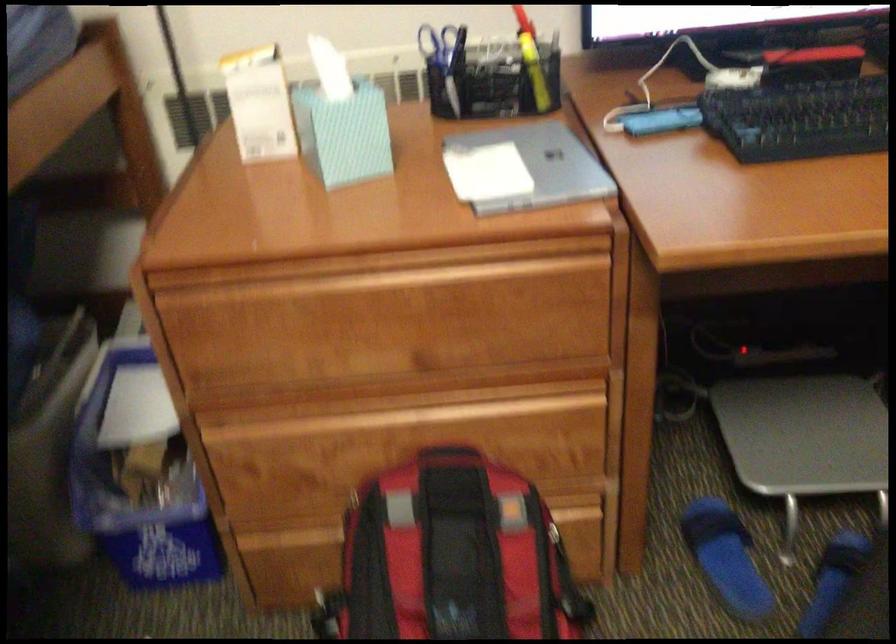
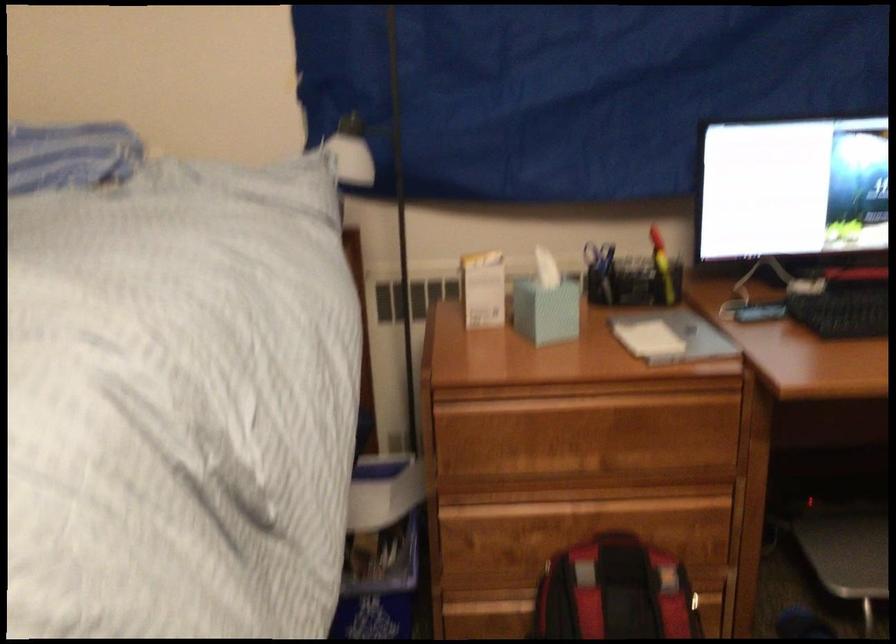
Locate, in the second image, the point that corresponds to (x=444, y=71) in the first image.

(599, 272)